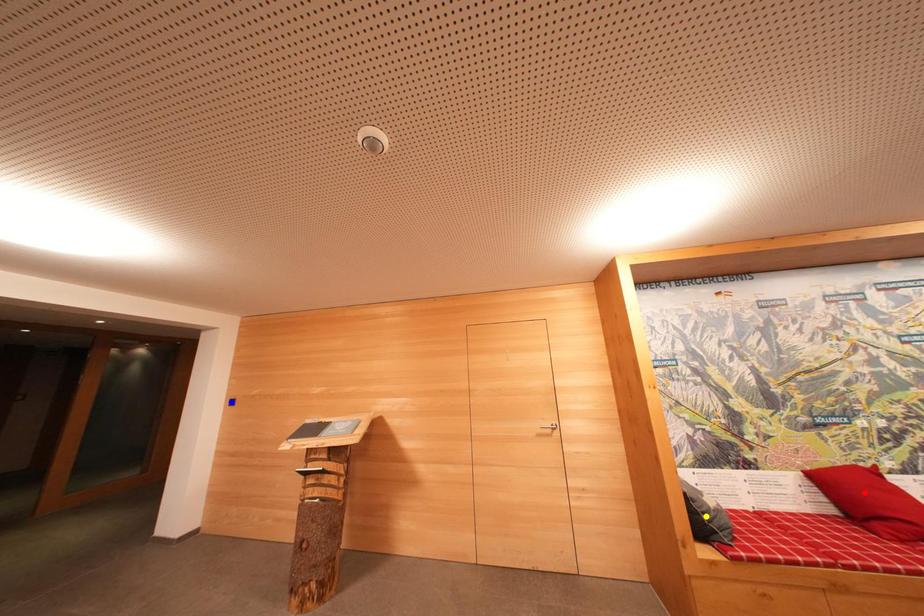
Order these from nearest to farthest:
A) yellow point
B) red point
C) blue point

red point → yellow point → blue point